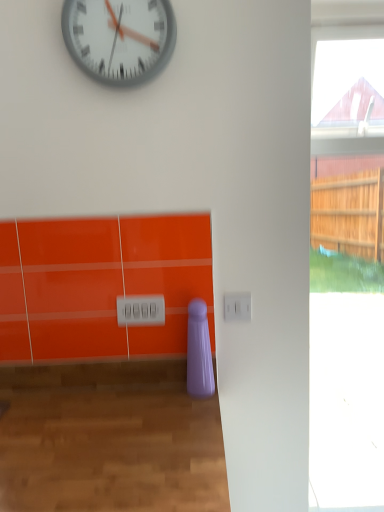
This screenshot has width=384, height=512. Describe the element at coordinates (119, 38) in the screenshot. I see `metallic gray clock at upper center` at that location.

This screenshot has width=384, height=512. What are the coordinates of `metallic gray clock at upper center` in the screenshot? It's located at (119, 38).

Find the location of a particular element. metallic gray clock at upper center is located at coordinates 119,38.